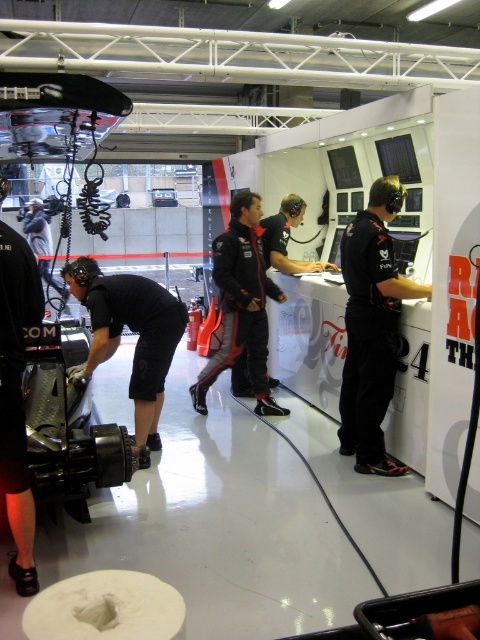
Looking at this image, between black matte mechanic at lower left and black matte suit at center, which one has less height?

black matte mechanic at lower left is shorter.

Who is more forward, (x=120, y=301) or (x=257, y=388)?

Positioned in front is point (x=120, y=301).

Where is `black matte mechanic at lower left`? This screenshot has height=640, width=480. black matte mechanic at lower left is located at coordinates (132, 330).

Who is positioned more to the right, black matte suit at right or black matte mechanic at lower left?

Positioned to the right is black matte suit at right.

How much distance is there between black matte suit at right and black matte mechanic at lower left?

The distance of black matte suit at right from black matte mechanic at lower left is 1.39 meters.

Which is behind, point (358, 428) or point (111, 284)?

The point (358, 428) is behind.

The height and width of the screenshot is (640, 480). What are the coordinates of `black matte suit at right` in the screenshot? It's located at (372, 326).

Based on the photo, is black matte suit at right bigger than black matte suit at center?

Actually, black matte suit at right might be smaller than black matte suit at center.

You are a GUI agent. You are given a task and a screenshot of the screen. Output one action in this format:
    pyautogui.click(x=<x>, y=<y>)
    Task: Click on the black matte suit at right
    
    Given the screenshot: What is the action you would take?
    pyautogui.click(x=372, y=326)